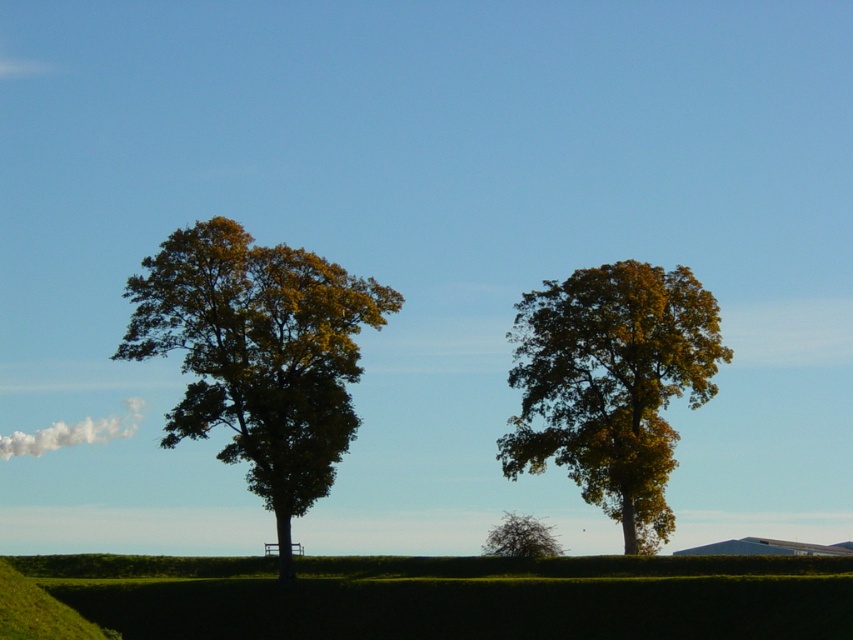
Looking at this image, who is positioned more to the right, green hedge at center or green leafy tree at left?

From the viewer's perspective, green hedge at center appears more on the right side.

Does green hedge at center have a lesser height compared to green leafy tree at left?

Indeed, green hedge at center has a lesser height compared to green leafy tree at left.

Which is in front, point (836, 557) or point (294, 440)?

Positioned in front is point (836, 557).

Image resolution: width=853 pixels, height=640 pixels. What are the coordinates of `green hedge at center` in the screenshot? It's located at (456, 596).

The width and height of the screenshot is (853, 640). Describe the element at coordinates (456, 596) in the screenshot. I see `green hedge at center` at that location.

Can you confirm if green hedge at center is positioned below green leafy tree at lower center?

No.

Does point (254, 582) come behind point (502, 552)?

No, it is not.

Find the location of a particular element. This screenshot has height=640, width=853. green hedge at center is located at coordinates (456, 596).

Where is `green hedge at center`? Image resolution: width=853 pixels, height=640 pixels. green hedge at center is located at coordinates (456, 596).

What do you see at coordinates (456, 596) in the screenshot?
I see `green hedge at center` at bounding box center [456, 596].

Where is `green hedge at center`? The image size is (853, 640). green hedge at center is located at coordinates point(456,596).